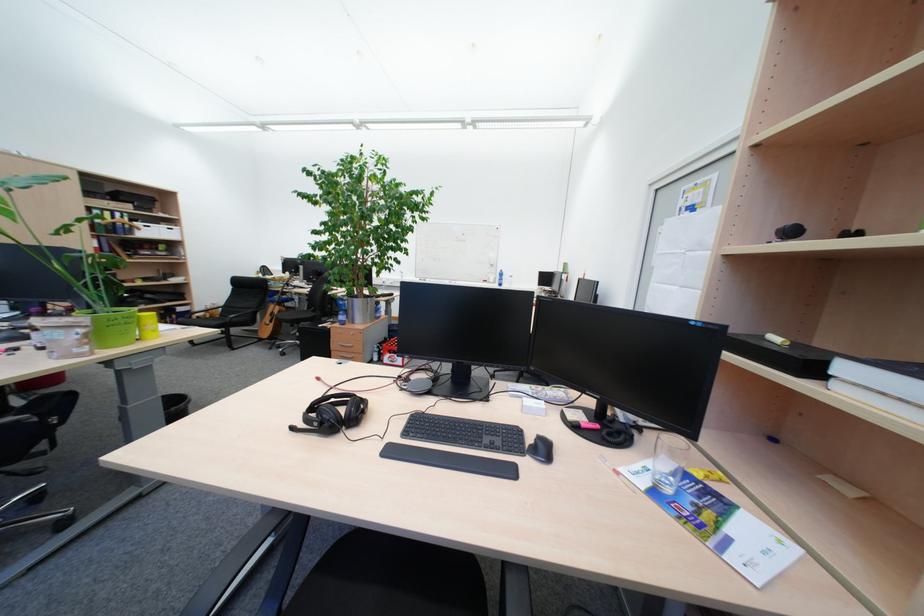
This screenshot has width=924, height=616. Describe the element at coordinates (34, 411) in the screenshot. I see `the chair armrest` at that location.